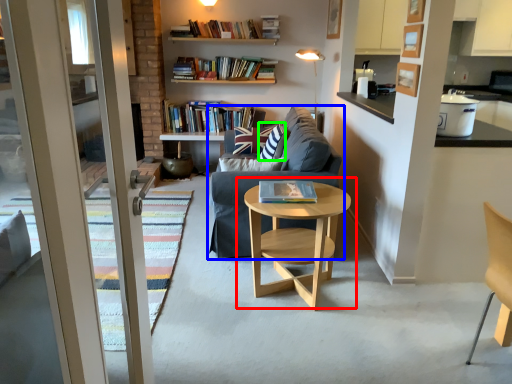
Question: Which is farther away from coffee table (highlighted by a red box)? studio couch (highlighted by a blue box) or pillow (highlighted by a green box)?

Choices:
 (A) studio couch
 (B) pillow

Answer: (B)